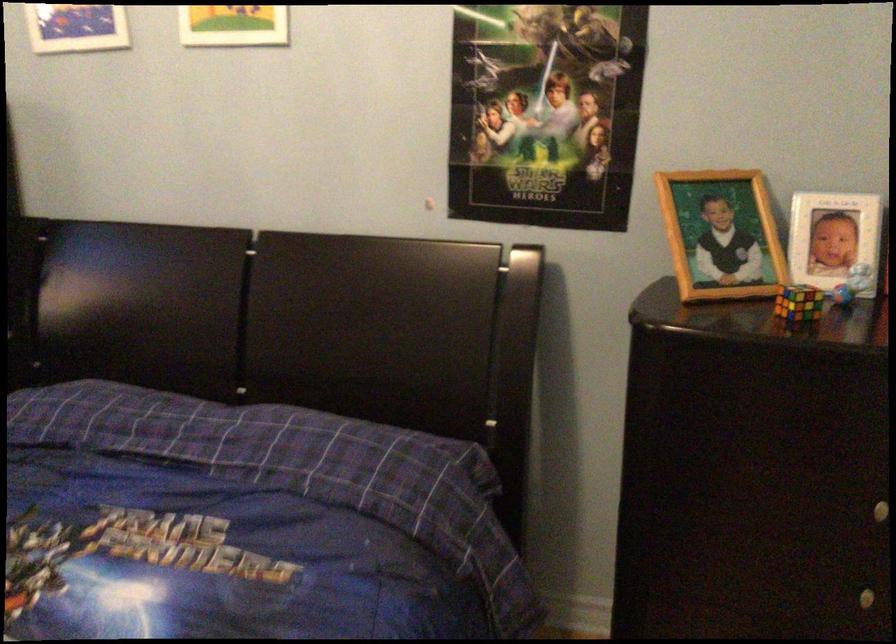
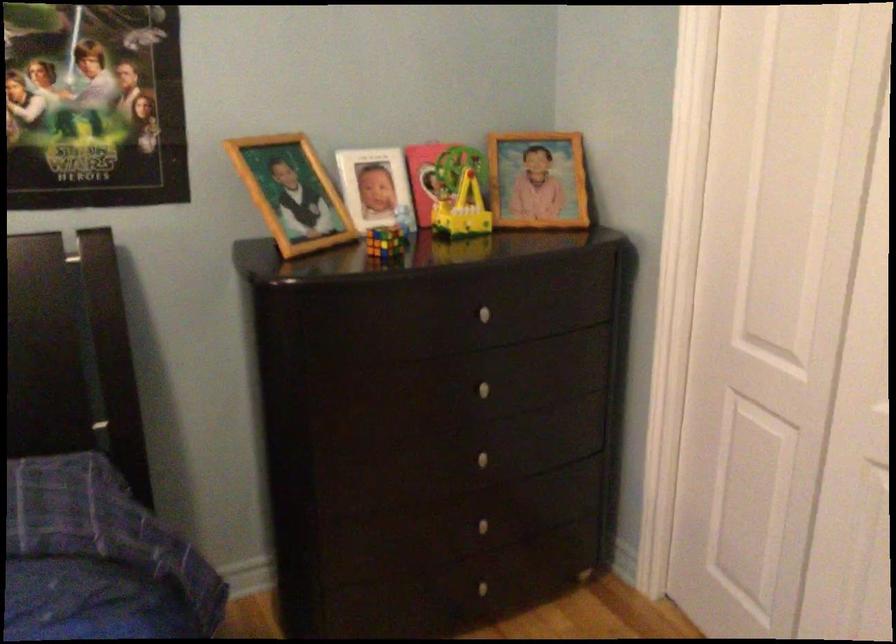
Question: The camera is either moving clockwise (left) or counter-clockwise (right) around the object. The first image is from the beginning of the video and the second image is from the end. Is the camera moving left or right when shooting the video?

Choices:
 (A) Left
 (B) Right

Answer: (A)